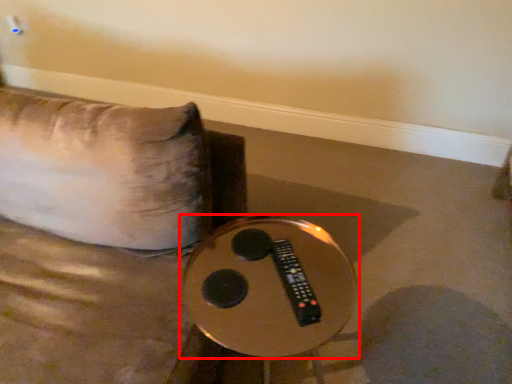
Question: From the image's perspective, what is the correct spatial positioning of table (annotated by the red box) in reference to remote?

Choices:
 (A) above
 (B) below

Answer: (B)